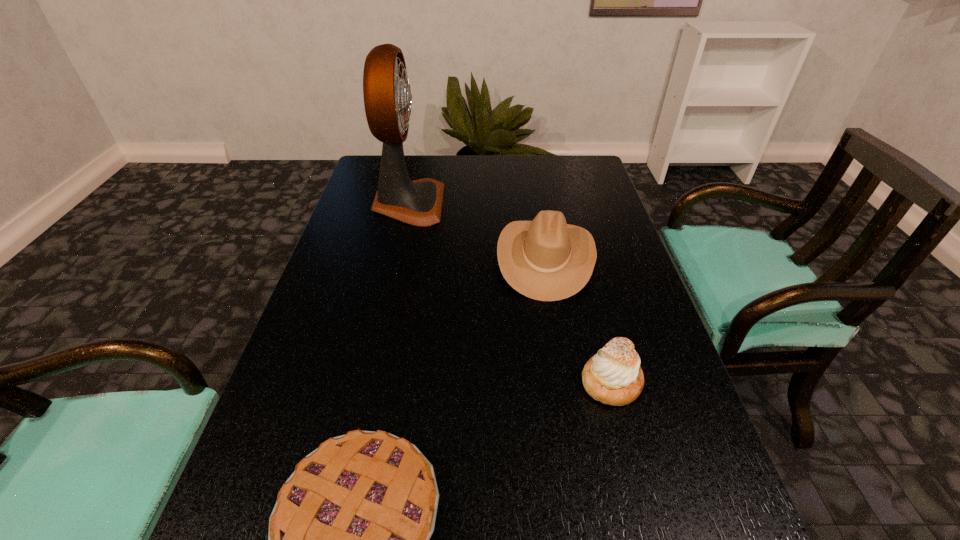
Locate an element on the screen. Image resolution: width=960 pixels, height=540 pixels. the tallest object is located at coordinates (387, 95).

The width and height of the screenshot is (960, 540). Identify the location of cowboy hat. (546, 259).

You are a GUI agent. You are given a task and a screenshot of the screen. Output one action in this format:
    pyautogui.click(x=<x>, y=<y>)
    Task: Click on the second nearest object
    The width and height of the screenshot is (960, 540).
    Given the screenshot: What is the action you would take?
    pyautogui.click(x=613, y=376)

The width and height of the screenshot is (960, 540). Find the location of `free space located on the front-facing side of the tallest object`. free space located on the front-facing side of the tallest object is located at coordinates (568, 204).

Where is `vacant area located on the front of the cowboy hat`? The height and width of the screenshot is (540, 960). vacant area located on the front of the cowboy hat is located at coordinates (577, 440).

Locate an element on the screen. This screenshot has height=540, width=960. free space located 0.150m on the front of the third farthest object is located at coordinates (639, 491).

In order to click on object located in the far edge section of the desktop in this screenshot , I will do `click(387, 95)`.

The width and height of the screenshot is (960, 540). I want to click on object that is positioned at the left edge, so click(x=387, y=95).

You are a GUI agent. You are given a task and a screenshot of the screen. Output one action in this format:
    pyautogui.click(x=<x>, y=<y>)
    Task: Click on the cowboy hat at the right edge
    Image resolution: width=960 pixels, height=540 pixels.
    Given the screenshot: What is the action you would take?
    pyautogui.click(x=546, y=259)

I want to click on pastry that is at the right edge, so click(613, 376).